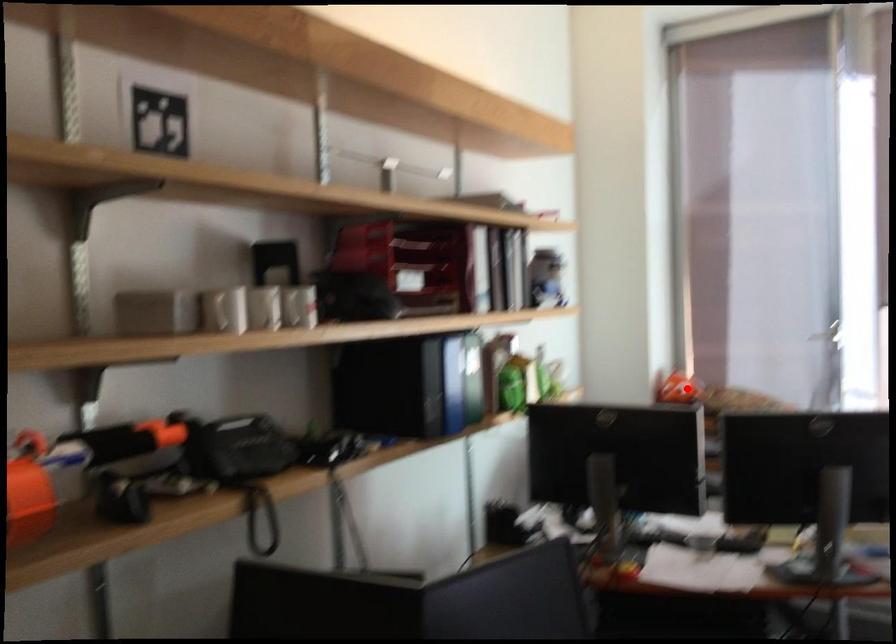
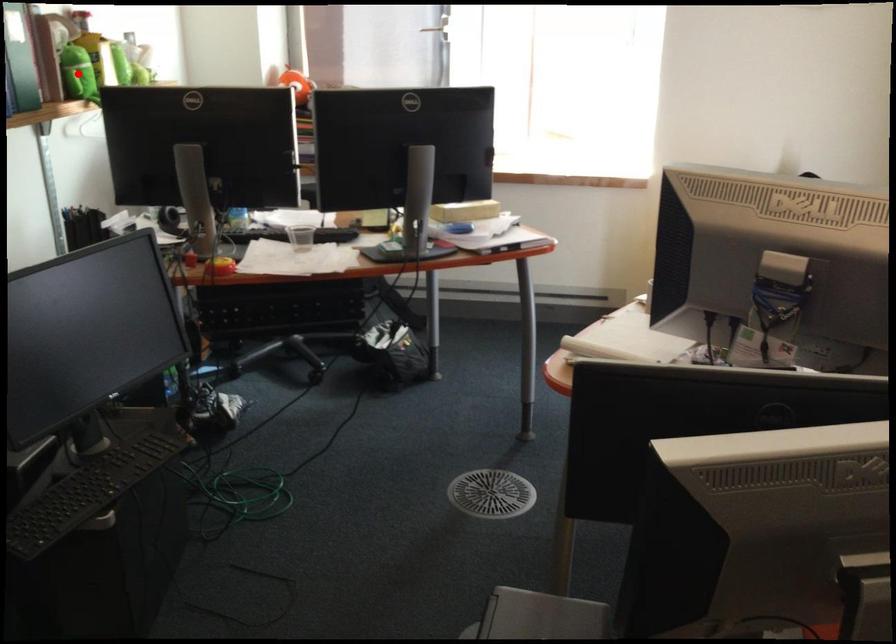
I am providing you with two images of the same scene from different viewpoints. A red point is marked on the first image and another point is marked on the second image. Is the red point in image1 aligned with the point shown in image2?

No